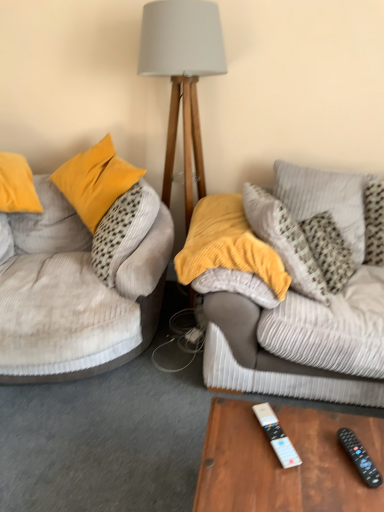
At what (x,y) coordinates should I click in order to perform the action: click on free space behind white plastic remote control at lower center, which is counted as the first remote control, starting from the left. Please return your answer as a coordinate pair (x, y). The width and height of the screenshot is (384, 512). Looking at the image, I should click on (267, 411).